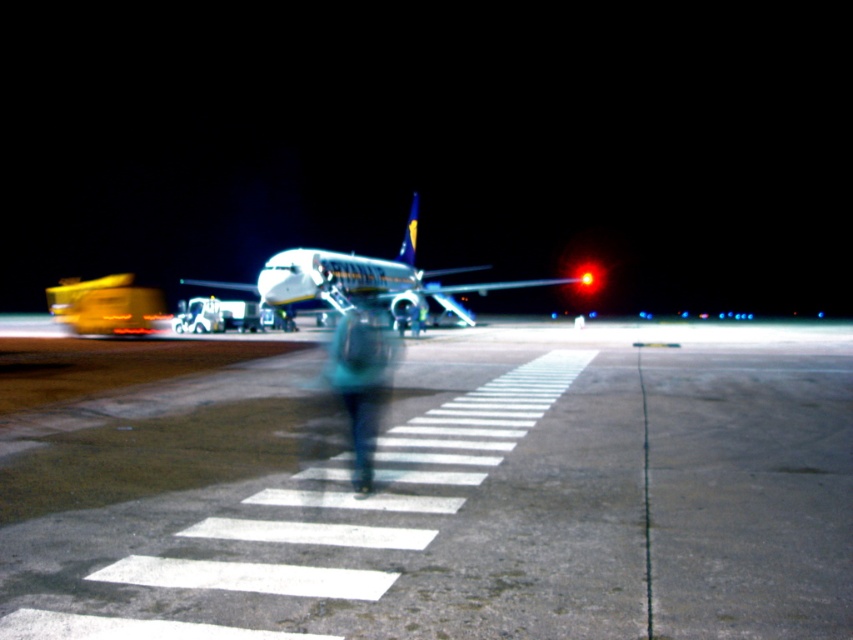
Question: Observing the image, what is the correct spatial positioning of white painted lines at center in reference to white glossy airplane at center?

Choices:
 (A) right
 (B) left

Answer: (A)

Question: Is white glossy airplane at center below teal fabric jacket at center?

Choices:
 (A) no
 (B) yes

Answer: (A)

Question: Which point is closer to the camera taking this photo?

Choices:
 (A) (376, 401)
 (B) (392, 259)
 (C) (404, 388)

Answer: (A)

Question: Which point appears farthest from the camera in this image?

Choices:
 (A) (412, 220)
 (B) (367, 465)
 (C) (97, 451)

Answer: (A)

Question: Is white glossy airplane at center below teal fabric jacket at center?

Choices:
 (A) yes
 (B) no

Answer: (B)

Question: Which of these objects is positioned farthest from the teal fabric jacket at center?

Choices:
 (A) white glossy airplane at center
 (B) white painted lines at center

Answer: (A)